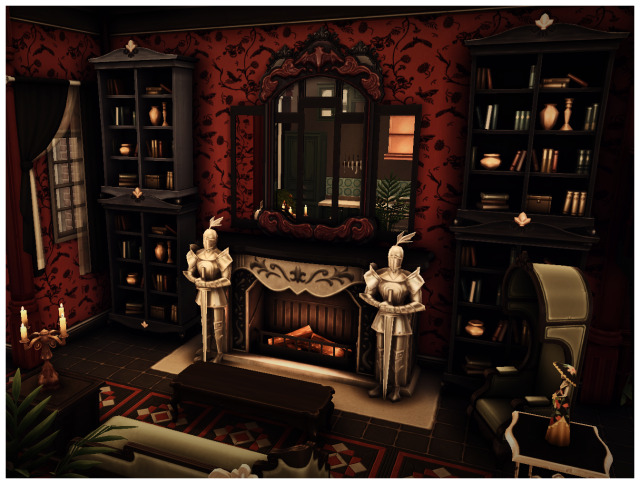
You are a GUI agent. You are given a task and a screenshot of the screen. Output one action in this format:
    pyautogui.click(x=<x>, y=<y>)
    Task: Click on the table
    The image size is (640, 484).
    Given the screenshot: What is the action you would take?
    pyautogui.click(x=237, y=394)